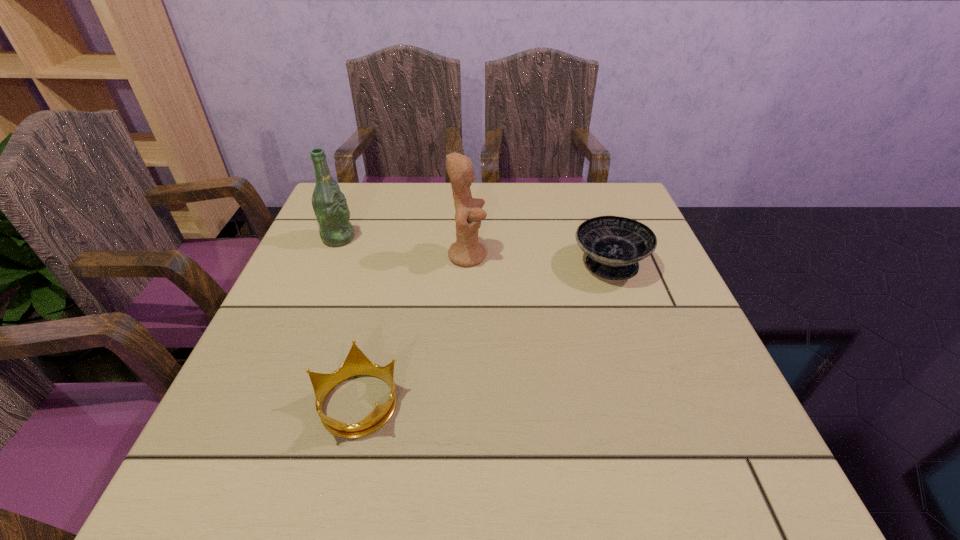
Identify the location of crown that is positioned at the left edge. (356, 363).

At what (x,y) coordinates should I click in order to perform the action: click on object that is at the right edge. Please return your answer as a coordinate pair (x, y). Image resolution: width=960 pixels, height=540 pixels. Looking at the image, I should click on (614, 245).

In the image, there is a desktop. Find the location of `blank space at the far edge`. blank space at the far edge is located at coordinates (557, 202).

Where is `vacant space at the near edge of the desktop`? vacant space at the near edge of the desktop is located at coordinates (564, 459).

This screenshot has width=960, height=540. In the image, there is a desktop. What are the coordinates of `vacant space at the left edge` in the screenshot? It's located at (240, 427).

Locate an element on the screen. Image resolution: width=960 pixels, height=540 pixels. vacant space at the right edge is located at coordinates (660, 437).

Find the location of a particular element. This screenshot has height=540, width=960. free space at the far left corner of the desktop is located at coordinates (364, 222).

Image resolution: width=960 pixels, height=540 pixels. Identify the location of free space between the beer bottle and the nearest object. 348,320.

The image size is (960, 540). What are the coordinates of `vacant region between the second object from left to right and the rightmost object` in the screenshot? It's located at (484, 334).

At what (x,y) coordinates should I click in order to perform the action: click on vacant area that lies between the figurine and the leftmost object. Please return your answer as a coordinate pair (x, y). Looking at the image, I should click on (403, 247).